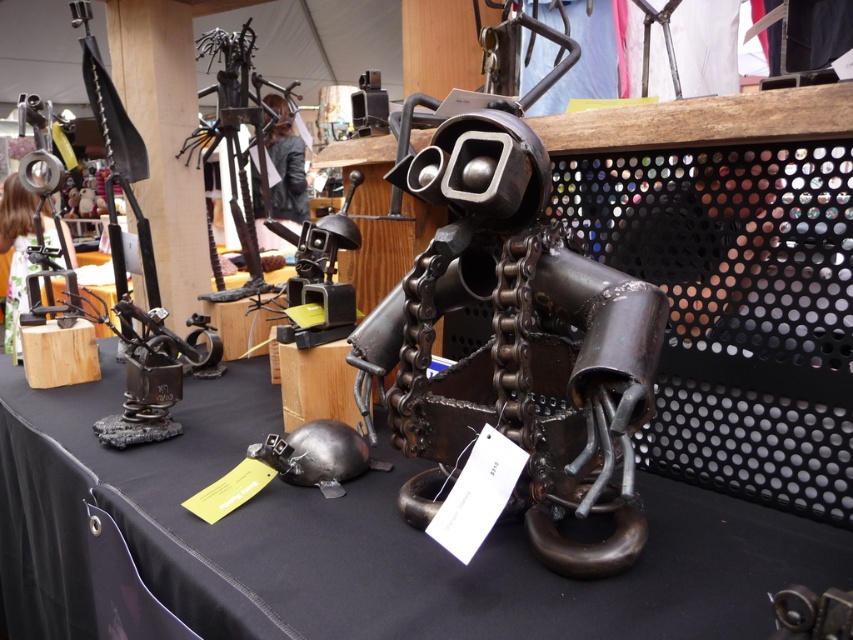
Question: Is black matte tablecloth at center in front of metallic chain at center?

Choices:
 (A) yes
 (B) no

Answer: (A)

Question: Is black matte tablecloth at center to the right of metallic chain at center from the viewer's perspective?

Choices:
 (A) no
 (B) yes

Answer: (A)

Question: Is black matte tablecloth at center thinner than metallic chain at center?

Choices:
 (A) yes
 (B) no

Answer: (B)

Question: Among these objects, which one is nearest to the camera?

Choices:
 (A) metallic chain at center
 (B) black matte tablecloth at center

Answer: (B)

Question: Among these points, which one is nearest to the camera?

Choices:
 (A) (556, 628)
 (B) (408, 428)

Answer: (A)